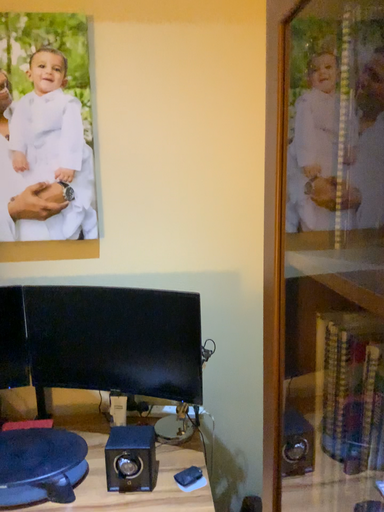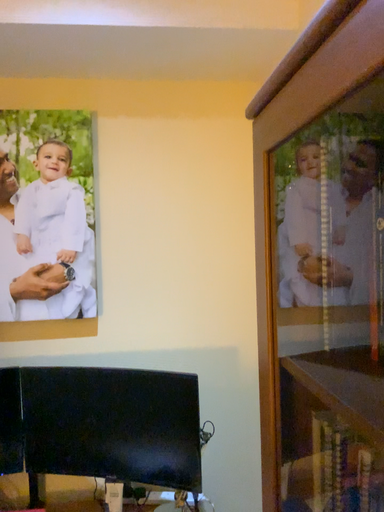
Question: Which way did the camera rotate in the video?

Choices:
 (A) rotated upward
 (B) rotated downward

Answer: (A)